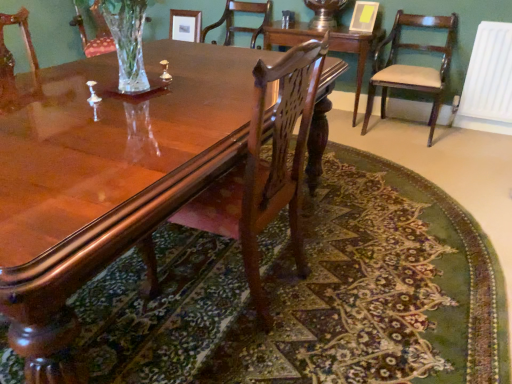
You are a GUI agent. You are given a task and a screenshot of the screen. Output one action in this format:
    pyautogui.click(x=<x>, y=<y>)
    Task: Click on the polished wood chair at center, the second chair when ordered from right to left
    This screenshot has width=512, height=384.
    Given the screenshot: What is the action you would take?
    pyautogui.click(x=265, y=168)

Describe the element at coordinates (354, 53) in the screenshot. This screenshot has height=384, width=512. I see `mahogany wood table at center` at that location.

Describe the element at coordinates (488, 81) in the screenshot. This screenshot has height=384, width=512. I see `white plastic radiator at right` at that location.

Image resolution: width=512 pixels, height=384 pixels. What do you see at coordinates (412, 65) in the screenshot?
I see `mahogany wood chair at right, placed as the first chair when sorted from right to left` at bounding box center [412, 65].

This screenshot has height=384, width=512. I want to click on glossy wood coffee table at center, so click(105, 183).

Find the location of a particular element. This screenshot has width=512, height=384. polished wood chair at center, which appears as the 3th chair when viewed from the back is located at coordinates (265, 168).

Does point (352, 35) come behind point (247, 166)?

Yes, it is behind point (247, 166).

Is mahogany wood table at center in front of or behind polished wood chair at center, the second chair when ordered from right to left, in the image?

In the image, mahogany wood table at center appears behind polished wood chair at center, the second chair when ordered from right to left.

Which of these two, mahogany wood table at center or polished wood chair at center, which appears as the 3th chair when viewed from the back, is smaller?

With smaller size is polished wood chair at center, which appears as the 3th chair when viewed from the back.

From a real-world perspective, count 2nd chairs upward from the mahogany wood table at center and point to it. Please provide its 2D coordinates.

[(265, 168)]

Which point is more forward, [351,47] or [482,98]?

The point [351,47] is more forward.

Would you say mahogany wood table at center contains white plastic radiator at right?

No, white plastic radiator at right is not surrounded by mahogany wood table at center.

From a real-world perspective, is mahogany wood table at center located beneath white plastic radiator at right?

Correct, in the physical world, mahogany wood table at center is lower than white plastic radiator at right.

Considering the sizes of objects mahogany wood table at center and white plastic radiator at right in the image provided, who is shorter, mahogany wood table at center or white plastic radiator at right?

mahogany wood table at center.

Considering the relative positions of polished wood chair at center, the second chair when ordered from right to left, and glossy wood coffee table at center in the image provided, is polished wood chair at center, the second chair when ordered from right to left, to the left of glossy wood coffee table at center from the viewer's perspective?

In fact, polished wood chair at center, the second chair when ordered from right to left, is to the right of glossy wood coffee table at center.

Based on the photo, is glossy wood coffee table at center located within polished wood chair at center, placed as the first chair when sorted from front to back?

Definitely not — glossy wood coffee table at center is not inside polished wood chair at center, placed as the first chair when sorted from front to back.

How different are the orientations of polished wood chair at center, the second chair when ordered from right to left, and glossy wood coffee table at center in degrees?

176 degrees.

Does point (290, 210) appear closer or farther from the camera than point (234, 56)?

Point (290, 210) appears to be closer to the viewer than point (234, 56).

From the image's perspective, relative to wooden chair at center, which is the 3th chair in front-to-back order, is mahogany wood table at center above or below?

mahogany wood table at center is situated lower than wooden chair at center, which is the 3th chair in front-to-back order, in the image.

Does mahogany wood table at center appear on the left side of wooden chair at center, the third chair positioned from the right?

No, mahogany wood table at center is not to the left of wooden chair at center, the third chair positioned from the right.

Is mahogany wood table at center with wooden chair at center, acting as the first chair starting from the left?

No.

Between point (373, 41) and point (262, 25), which one is positioned behind?

The point (262, 25) is farther.

The height and width of the screenshot is (384, 512). I want to click on the 2nd chair to the right of the glossy wood coffee table at center, counting from the anchor's position, so click(x=265, y=168).

Does glossy wood coffee table at center appear on the right side of polished wood chair at center, the second chair when ordered from right to left?

Incorrect, glossy wood coffee table at center is not on the right side of polished wood chair at center, the second chair when ordered from right to left.

What's the angular difference between glossy wood coffee table at center and polished wood chair at center, which appears as the 3th chair when viewed from the back,'s facing directions?

The angular difference between glossy wood coffee table at center and polished wood chair at center, which appears as the 3th chair when viewed from the back, is 176 degrees.

Which object is wider, glossy wood coffee table at center or polished wood chair at center, which ranks as the second chair in left-to-right order?

With larger width is glossy wood coffee table at center.

Is point (394, 53) positioned behind point (294, 191)?

Yes.

Is mahogany wood chair at right, the 2th chair in the back-to-front sequence, outside of polished wood chair at center, placed as the first chair when sorted from front to back?

Yes, mahogany wood chair at right, the 2th chair in the back-to-front sequence, is located beyond the bounds of polished wood chair at center, placed as the first chair when sorted from front to back.

Does mahogany wood chair at right, positioned as the 3th chair in left-to-right order, come behind polished wood chair at center, which appears as the 3th chair when viewed from the back?

Yes.

Considering the sizes of polished wood chair at center, which appears as the 3th chair when viewed from the back, and white plastic radiator at right in the image, is polished wood chair at center, which appears as the 3th chair when viewed from the back, taller or shorter than white plastic radiator at right?

Clearly, polished wood chair at center, which appears as the 3th chair when viewed from the back, is taller compared to white plastic radiator at right.

Is white plastic radiator at right surrounded by polished wood chair at center, which ranks as the second chair in left-to-right order?

That's incorrect, white plastic radiator at right is not inside polished wood chair at center, which ranks as the second chair in left-to-right order.

Is polished wood chair at center, which appears as the 3th chair when viewed from the back, in front of or behind white plastic radiator at right in the image?

Visually, polished wood chair at center, which appears as the 3th chair when viewed from the back, is located in front of white plastic radiator at right.

Are polished wood chair at center, which ranks as the second chair in left-to-right order, and white plastic radiator at right far apart?

Yes, polished wood chair at center, which ranks as the second chair in left-to-right order, is far from white plastic radiator at right.

The image size is (512, 384). Find the location of `the 2nd chair in front of the mahogany wood table at center`. the 2nd chair in front of the mahogany wood table at center is located at coordinates (265, 168).

You are a GUI agent. You are given a task and a screenshot of the screen. Output one action in this format:
    pyautogui.click(x=<x>, y=<y>)
    Task: Click on the table on the left of white plastic radiator at right
    
    Given the screenshot: What is the action you would take?
    pos(354,53)

Based on their spatial positions, is mahogany wood table at center or white plastic radiator at right further from mahogany wood chair at right, positioned as the 3th chair in left-to-right order?

The object further to mahogany wood chair at right, positioned as the 3th chair in left-to-right order, is mahogany wood table at center.

Estimate the real-world distances between objects in this image. Which object is closer to mahogany wood chair at right, the 2th chair in the back-to-front sequence, glossy wood coffee table at center or wooden chair at center, which is the 3th chair in front-to-back order?

wooden chair at center, which is the 3th chair in front-to-back order, lies closer to mahogany wood chair at right, the 2th chair in the back-to-front sequence, than the other object.

When comparing their distances from wooden chair at center, acting as the first chair starting from the left, does glossy wood coffee table at center or mahogany wood chair at right, the 2th chair in the back-to-front sequence, seem closer?

mahogany wood chair at right, the 2th chair in the back-to-front sequence, is positioned closer to the anchor wooden chair at center, acting as the first chair starting from the left.

Looking at the image, which one is located closer to white plastic radiator at right, mahogany wood chair at right, the 2th chair in the back-to-front sequence, or polished wood chair at center, the second chair when ordered from right to left?

Among the two, mahogany wood chair at right, the 2th chair in the back-to-front sequence, is located nearer to white plastic radiator at right.

Looking at the image, which one is located closer to wooden chair at center, which is the 3th chair in front-to-back order, white plastic radiator at right or mahogany wood table at center?

Among the two, mahogany wood table at center is located nearer to wooden chair at center, which is the 3th chair in front-to-back order.

When comparing their distances from white plastic radiator at right, does polished wood chair at center, placed as the first chair when sorted from front to back, or glossy wood coffee table at center seem further?

Among the two, polished wood chair at center, placed as the first chair when sorted from front to back, is located further to white plastic radiator at right.

Based on their spatial positions, is glossy wood coffee table at center or wooden chair at center, the 1th chair positioned from the back, closer to white plastic radiator at right?

The object closer to white plastic radiator at right is wooden chair at center, the 1th chair positioned from the back.

Estimate the real-world distances between objects in this image. Which object is closer to glossy wood coffee table at center, mahogany wood chair at right, the 2th chair in the back-to-front sequence, or mahogany wood table at center?

The object closer to glossy wood coffee table at center is mahogany wood table at center.

This screenshot has width=512, height=384. Find the location of `radiator between glossy wood coffee table at center and mahogany wood table at center in the front-back direction`. radiator between glossy wood coffee table at center and mahogany wood table at center in the front-back direction is located at coordinates (488, 81).

Locate an element on the screen. chair between mahogany wood table at center and white plastic radiator at right in the horizontal direction is located at coordinates (412, 65).

Find the location of a particular element. radiator positioned between glossy wood coffee table at center and wooden chair at center, which is the 3th chair in front-to-back order, from near to far is located at coordinates (488, 81).

Find the location of `chair located between polished wood chair at center, which appears as the 3th chair when viewed from the back, and white plastic radiator at right in the depth direction`. chair located between polished wood chair at center, which appears as the 3th chair when viewed from the back, and white plastic radiator at right in the depth direction is located at coordinates (412, 65).